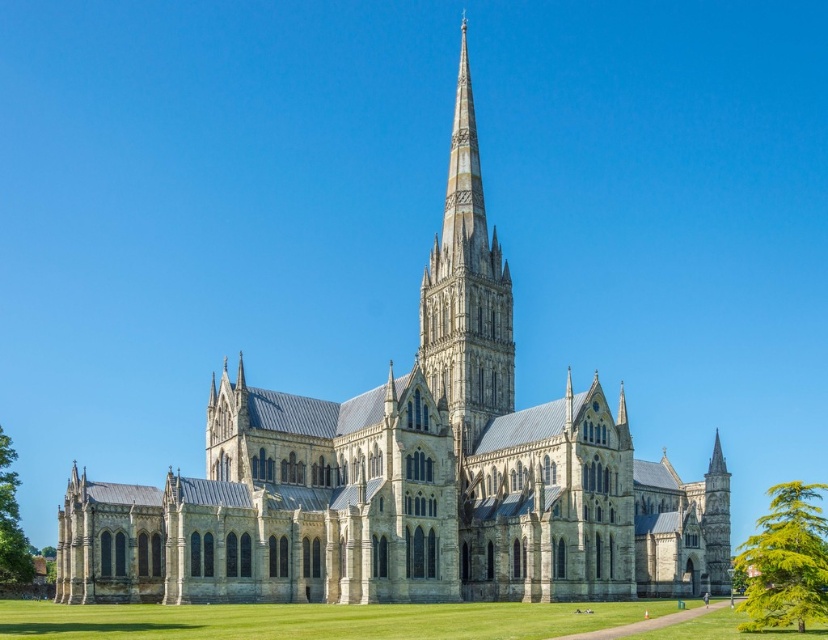
Is the position of gray stone spire at center less distant than that of green leafy tree at lower right?

That is False.

Who is taller, gray stone spire at center or green leafy tree at lower right?

With more height is gray stone spire at center.

Between point (455, 122) and point (802, 632), which one is positioned behind?

Point (455, 122)

Find the location of a particular element. gray stone spire at center is located at coordinates (465, 292).

Measure the distance between green grass at lower center and green leafy tree at lower left.

green grass at lower center is 24.23 meters away from green leafy tree at lower left.

You are a GUI agent. You are given a task and a screenshot of the screen. Output one action in this format:
    pyautogui.click(x=<x>, y=<y>)
    Task: Click on the green grass at lower center
    The height and width of the screenshot is (640, 828).
    Given the screenshot: What is the action you would take?
    pyautogui.click(x=316, y=620)

Between point (362, 625) and point (437, 342), which one is positioned behind?

The point (437, 342) is behind.

Does point (349, 634) come closer to viewer compared to point (467, 204)?

Yes, it is.

Locate an element on the screen. This screenshot has width=828, height=640. green grass at lower center is located at coordinates (316, 620).